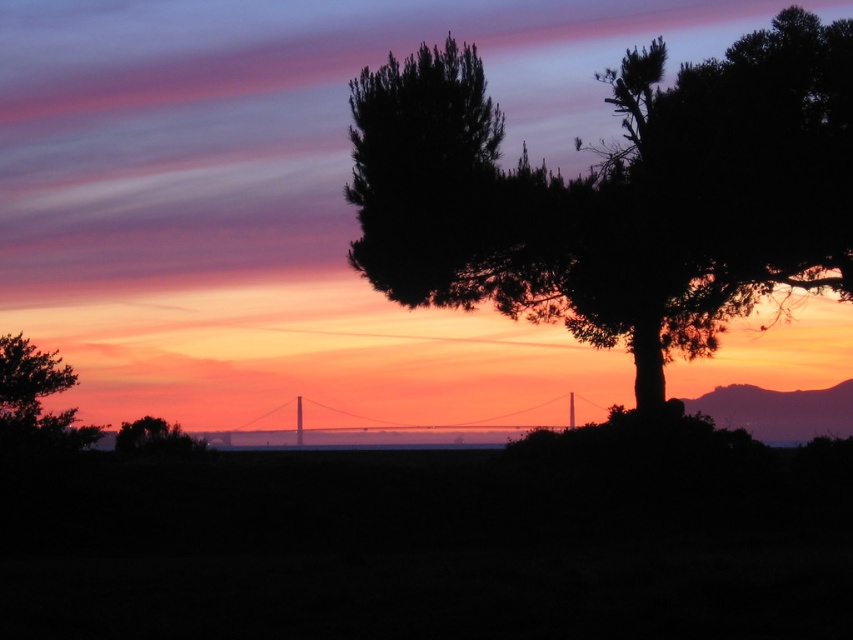
Question: Estimate the real-world distances between objects in this image. Which object is closer to the black silhouetted tree at upper right?

Choices:
 (A) metallic bridge at center
 (B) green matte tree at lower left
 (C) green matte tree at left

Answer: (B)

Question: Which of the following is the closest to the observer?

Choices:
 (A) (561, 221)
 (B) (51, 436)
 (C) (123, 440)

Answer: (B)

Question: Among these objects, which one is nearest to the camera?

Choices:
 (A) green matte tree at left
 (B) black silhouetted tree at upper right

Answer: (A)

Question: Is black silhouetted tree at upper right positioned before green matte tree at lower left?

Choices:
 (A) yes
 (B) no

Answer: (B)

Question: Does green matte tree at left appear on the right side of metallic bridge at center?

Choices:
 (A) yes
 (B) no

Answer: (B)

Question: Does green matte tree at left appear under green matte tree at lower left?

Choices:
 (A) no
 (B) yes

Answer: (A)